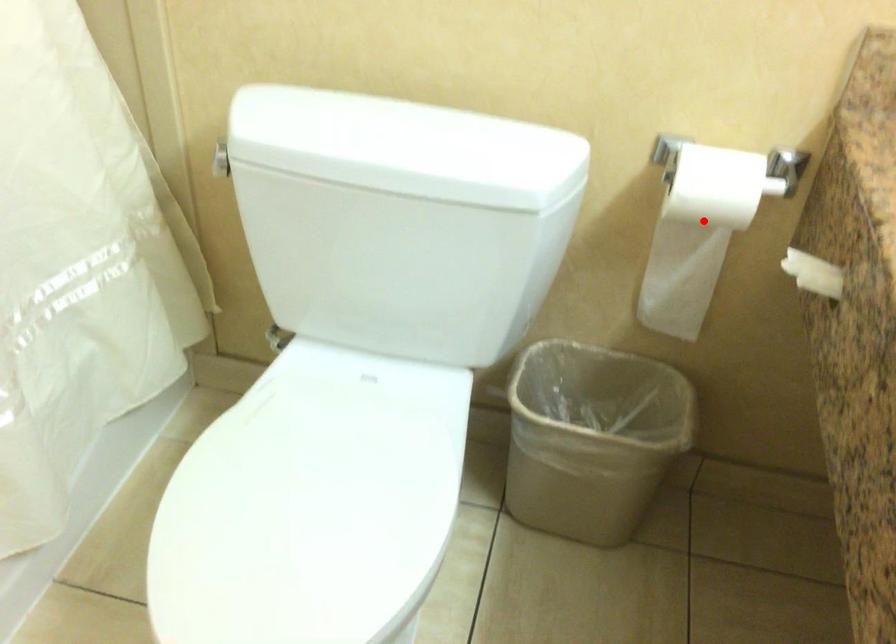
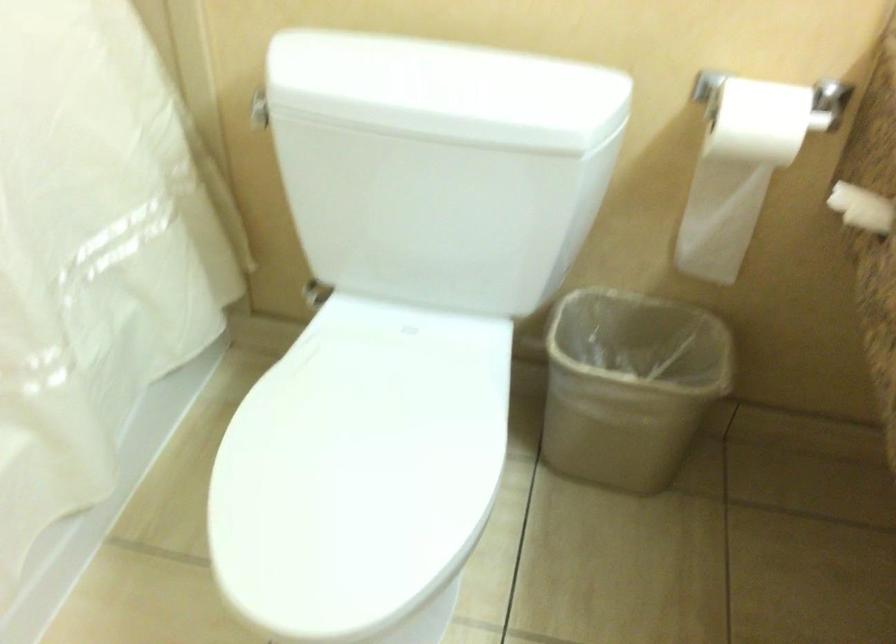
In the second image, find the point that corresponds to the highlighted location in the first image.

(744, 162)